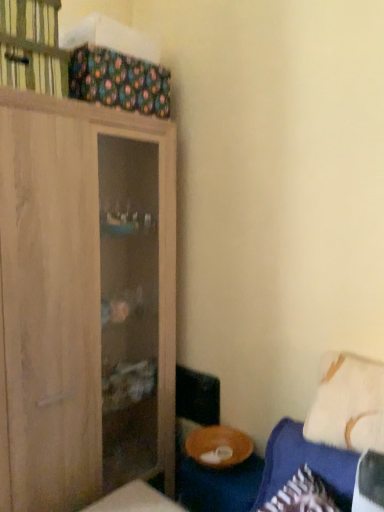
Question: Does wooden bowl at lower right have a greater height compared to wooden cabinet at upper left?

Choices:
 (A) yes
 (B) no

Answer: (A)

Question: Is the position of wooden bowl at lower right more distant than that of wooden cabinet at upper left?

Choices:
 (A) no
 (B) yes

Answer: (B)

Question: Does wooden bowl at lower right appear on the left side of wooden cabinet at upper left?

Choices:
 (A) yes
 (B) no

Answer: (B)

Question: Can you confirm if wooden bowl at lower right is thinner than wooden cabinet at upper left?

Choices:
 (A) no
 (B) yes

Answer: (B)

Question: From a real-world perspective, is wooden bowl at lower right on wooden cabinet at upper left?

Choices:
 (A) no
 (B) yes

Answer: (A)

Question: Is the surface of wooden bowl at lower right in direct contact with wooden cabinet at upper left?

Choices:
 (A) no
 (B) yes

Answer: (A)

Question: Are wooden cabinet at upper left and light wood cabinet at left making contact?

Choices:
 (A) yes
 (B) no

Answer: (B)

Question: Considering the relative sizes of wooden cabinet at upper left and light wood cabinet at left in the image provided, is wooden cabinet at upper left taller than light wood cabinet at left?

Choices:
 (A) yes
 (B) no

Answer: (B)

Question: Considering the relative positions of wooden cabinet at upper left and light wood cabinet at left in the image provided, is wooden cabinet at upper left in front of light wood cabinet at left?

Choices:
 (A) yes
 (B) no

Answer: (B)

Question: Is wooden cabinet at upper left shorter than light wood cabinet at left?

Choices:
 (A) yes
 (B) no

Answer: (A)

Question: Is wooden cabinet at upper left surrounding light wood cabinet at left?

Choices:
 (A) yes
 (B) no

Answer: (B)

Question: Can you confirm if wooden cabinet at upper left is smaller than light wood cabinet at left?

Choices:
 (A) no
 (B) yes

Answer: (B)

Question: Is white soft pillow at lower right outside of wooden cabinet at upper left?

Choices:
 (A) yes
 (B) no

Answer: (A)